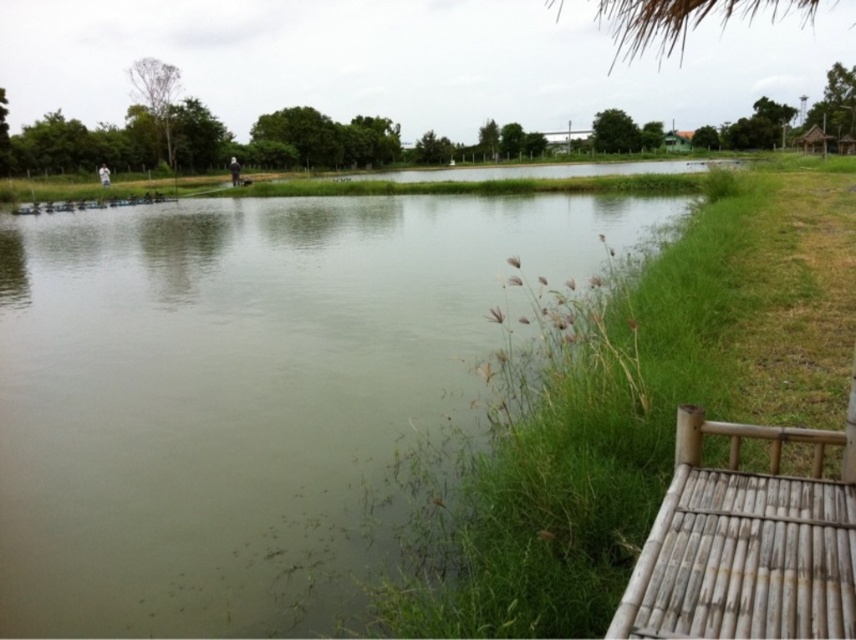
Question: Estimate the real-world distances between objects in this image. Which object is closer to the green grassy water at center?

Choices:
 (A) green grass at center
 (B) green wooden hut at upper right
 (C) brown wooden hut at right

Answer: (A)

Question: Among these points, which one is farthest from the camera?

Choices:
 (A) (708, 349)
 (B) (224, 624)
 (C) (819, 140)

Answer: (C)

Question: Does green grassy water at center appear on the right side of green wooden hut at upper right?

Choices:
 (A) no
 (B) yes

Answer: (A)

Question: Can you confirm if green grassy water at center is thinner than brown wooden hut at right?

Choices:
 (A) yes
 (B) no

Answer: (B)

Question: Which object is farther from the camera taking this photo?

Choices:
 (A) green wooden hut at upper right
 (B) brown wooden hut at right

Answer: (A)

Question: Is green grass at center wider than brown wooden hut at right?

Choices:
 (A) yes
 (B) no

Answer: (B)